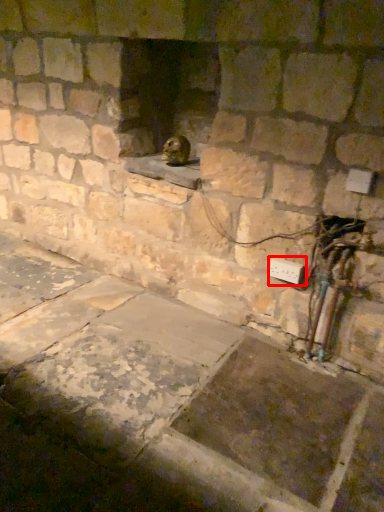
Question: From the image's perspective, considering the relative positions of electric outlet (annotated by the red box) and animal in the image provided, where is electric outlet (annotated by the red box) located with respect to the staircase?

Choices:
 (A) below
 (B) above

Answer: (A)